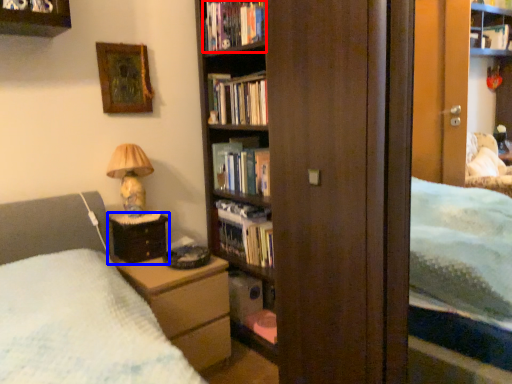
Question: Among these objects, which one is farthest to the camera, book (highlighted by a red box) or nightstand (highlighted by a blue box)?

Choices:
 (A) book
 (B) nightstand

Answer: (A)